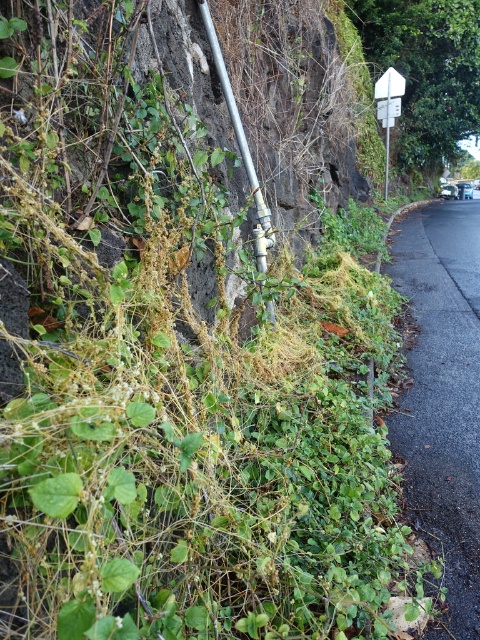
You are a maintenance worker checking the roadside wall. You need to access the white plastic sign at upper right. Is the metallic pipe at center blocking your direct path to it?

The metallic pipe at center is in front of the white plastic sign at upper right, so it is blocking the direct path to the sign.

You are a maintenance worker inspecting the roadside wall. You notice the metallic pipe at center and the white plastic sign at upper right. Which object is shorter in height?

The metallic pipe at center has a lesser height compared to the white plastic sign at upper right, so the metallic pipe at center is shorter.

You are a maintenance worker needing to locate the metallic pipe at center. According to the coordinates provided, where would you find it?

The metallic pipe at center is located at coordinates point (240, 147).